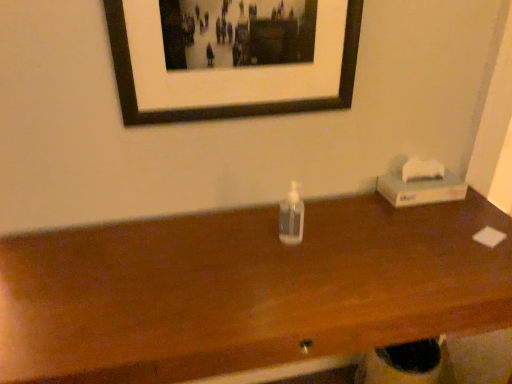
The height and width of the screenshot is (384, 512). What are the coordinates of `free spot to the left of transparent plastic bottle at center` in the screenshot? It's located at (228, 239).